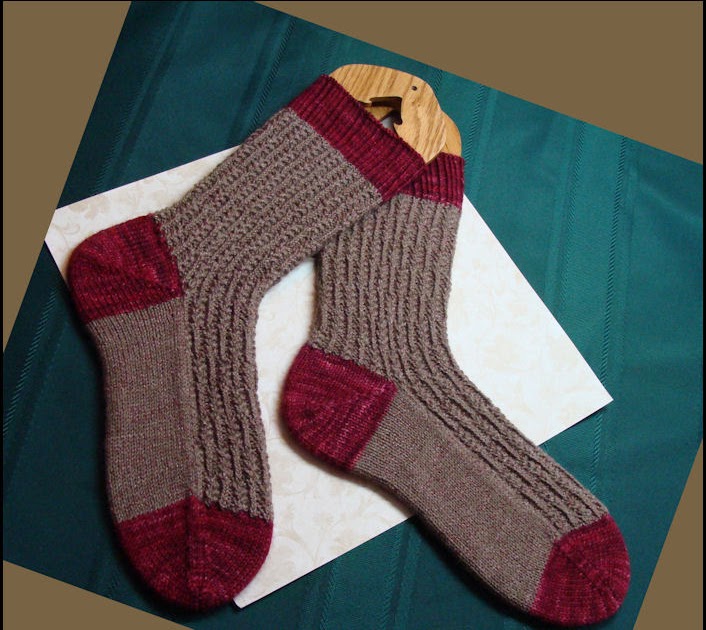
Locate an element on the screen. The height and width of the screenshot is (630, 706). table is located at coordinates (633, 52).